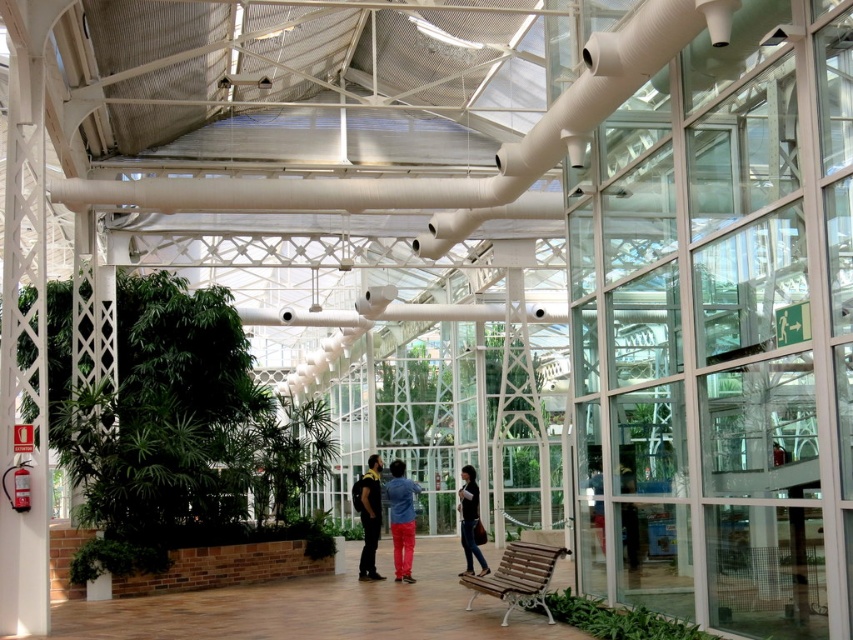
You are standing in the greenhouse and want to move from the point at coordinates point (219, 320) to the point at coordinates point (364, 513). Which direction should you move to get closer to your destination?

To move from point (219, 320) to point (364, 513), you should move northeast because the destination point has a higher x and y coordinate, indicating a northeasterly direction.

You are standing in the greenhouse and want to take a photo of the black matte shirt at center without the green leafy plant at left in the background. Which direction should you move to achieve this?

Move to the right side of the black matte shirt at center so that the green leafy plant at left is no longer in the background.